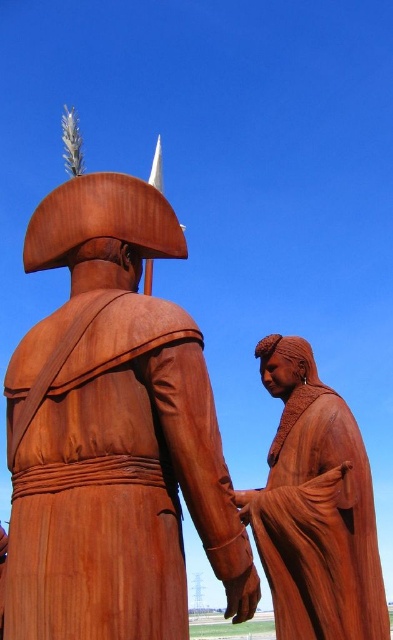
Between point (181, 369) and point (365, 582), which one is positioned in front?

Point (181, 369) is more forward.

Is rusty wood statue at left taller than rustic wood figure at center?

Yes, rusty wood statue at left is taller than rustic wood figure at center.

What do you see at coordinates (110, 428) in the screenshot? This screenshot has width=393, height=640. I see `rusty wood statue at left` at bounding box center [110, 428].

What are the coordinates of `rusty wood statue at left` in the screenshot? It's located at (110, 428).

Consider the image. Can you confirm if rusty wood statue at left is wider than rusty metal hand at center?

Correct, the width of rusty wood statue at left exceeds that of rusty metal hand at center.

The height and width of the screenshot is (640, 393). In order to click on rusty wood statue at left in this screenshot , I will do `click(110, 428)`.

In the scene shown: Which is below, rustic wood figure at center or rusty metal hand at center?

rusty metal hand at center is below.

Is point (312, 394) closer to camera compared to point (229, 582)?

That is False.

Where is `rustic wood figure at center`? rustic wood figure at center is located at coordinates click(315, 508).